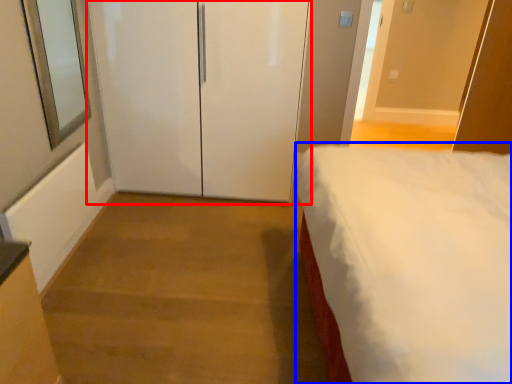
Question: Which object is closer to the camera taking this photo, door (highlighted by a red box) or bed (highlighted by a blue box)?

Choices:
 (A) door
 (B) bed

Answer: (B)